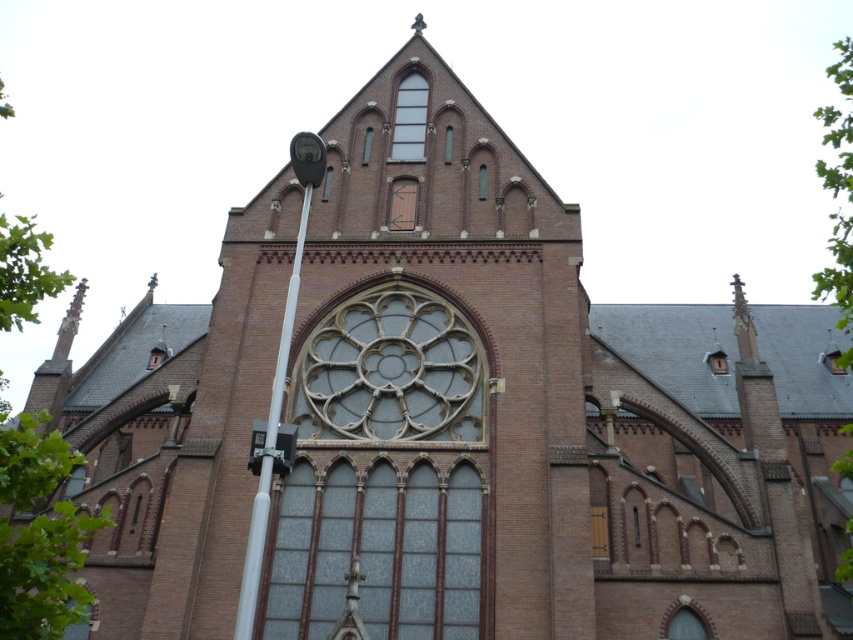
You are an architect analyzing the church facade. You notice the stained glass window at center and the green leafy tree at upper right. Which object appears larger in the image?

The green leafy tree at upper right appears larger than the stained glass window at center in the image.

You are a visitor approaching the church and want to enter through the clear glass door at center. As you approach, you notice a green leafy tree at upper right. Based on the scene description, will the tree block your path to the door?

The green leafy tree at upper right is positioned over the clear glass door at center, so it may cast a shadow but does not physically block the path to the door since it is above the door.

You are a visitor approaching the church entrance. You see the white metallic pole at left and the clear glass door at center. Which object is closer to the entrance?

The clear glass door at center is closer to the entrance because the white metallic pole at left is positioned under it, indicating it is behind the door in the structure.